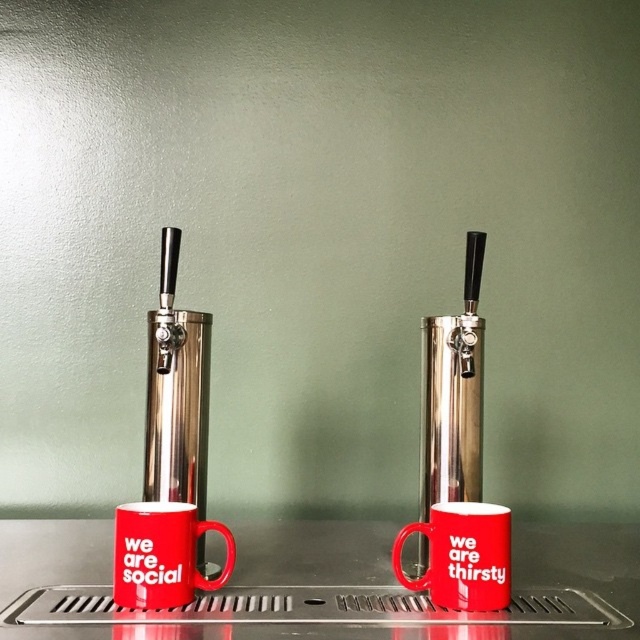
Question: Which point appears closest to the camera in this image?

Choices:
 (A) (148, 524)
 (B) (339, 604)
 (C) (396, 556)

Answer: (A)

Question: Considering the real-world distances, which object is farthest from the metallic stainless steel counter at center?

Choices:
 (A) matte red mug at center
 (B) matte ceramic mug at lower left

Answer: (B)

Question: Is metallic stainless steel counter at center wider than matte ceramic mug at lower left?

Choices:
 (A) no
 (B) yes

Answer: (B)

Question: Does metallic stainless steel counter at center appear on the right side of matte ceramic mug at lower left?

Choices:
 (A) no
 (B) yes

Answer: (B)

Question: Which point is farther to the camera?

Choices:
 (A) metallic stainless steel counter at center
 (B) matte ceramic mug at lower left
 (C) matte red mug at center

Answer: (C)

Question: Can you confirm if metallic stainless steel counter at center is wider than matte ceramic mug at lower left?

Choices:
 (A) no
 (B) yes

Answer: (B)